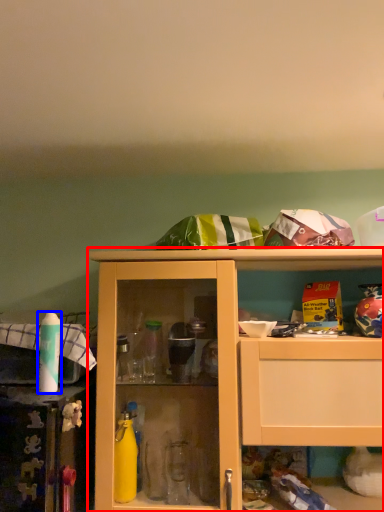
Question: Which object appears closest to the camera in this image, cabinetry (highlighted by a red box) or bottle (highlighted by a blue box)?

Choices:
 (A) cabinetry
 (B) bottle

Answer: (A)